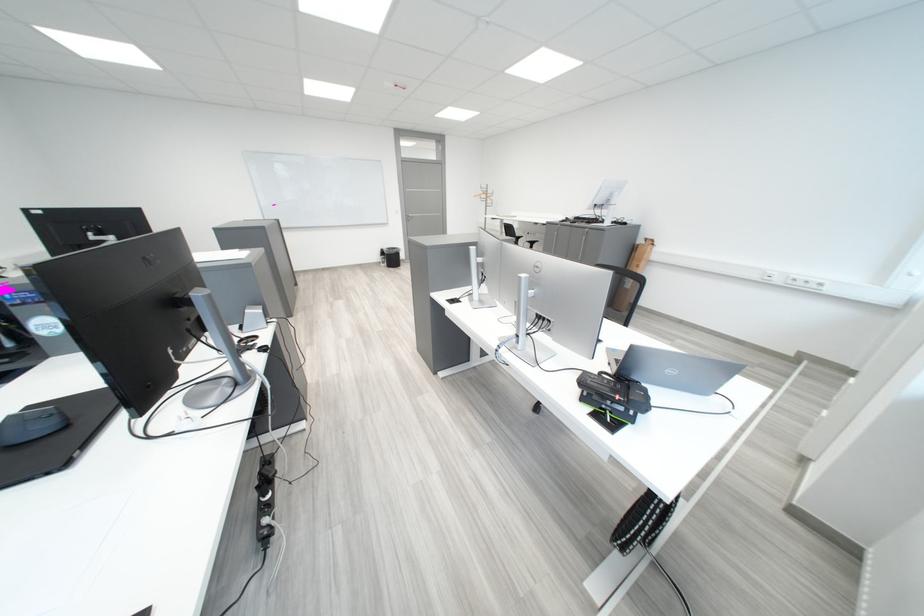
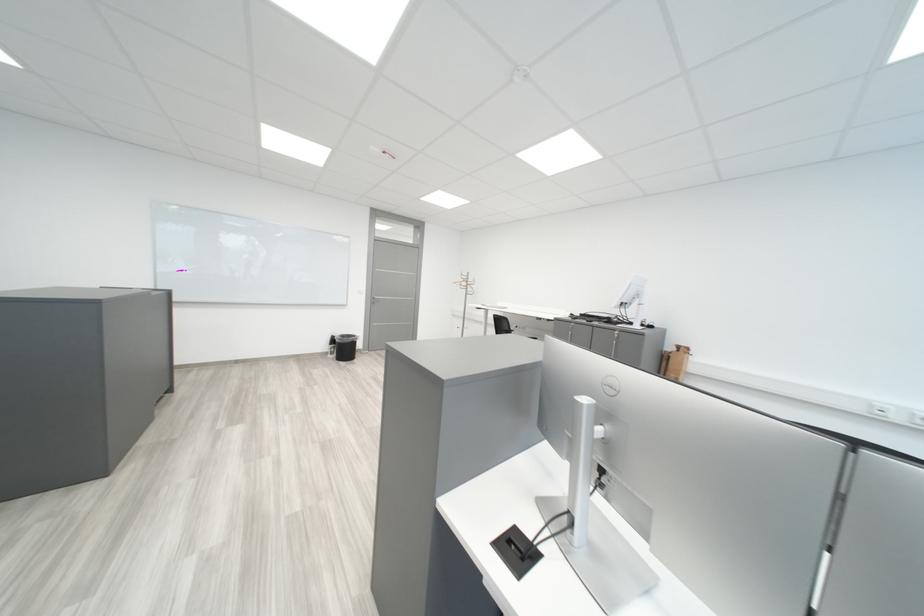
Find the pixel in the second image that matches point (390, 259) in the first image.

(336, 347)